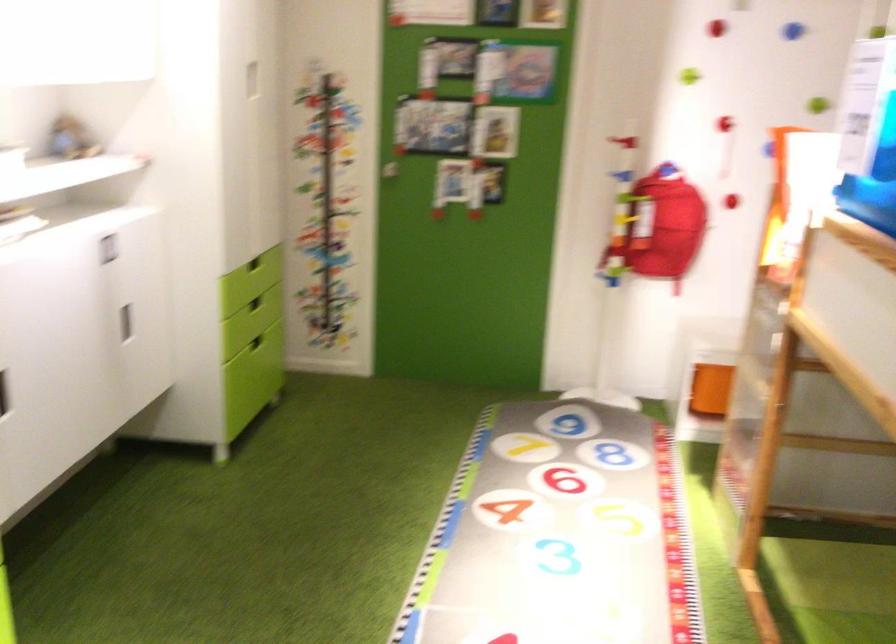
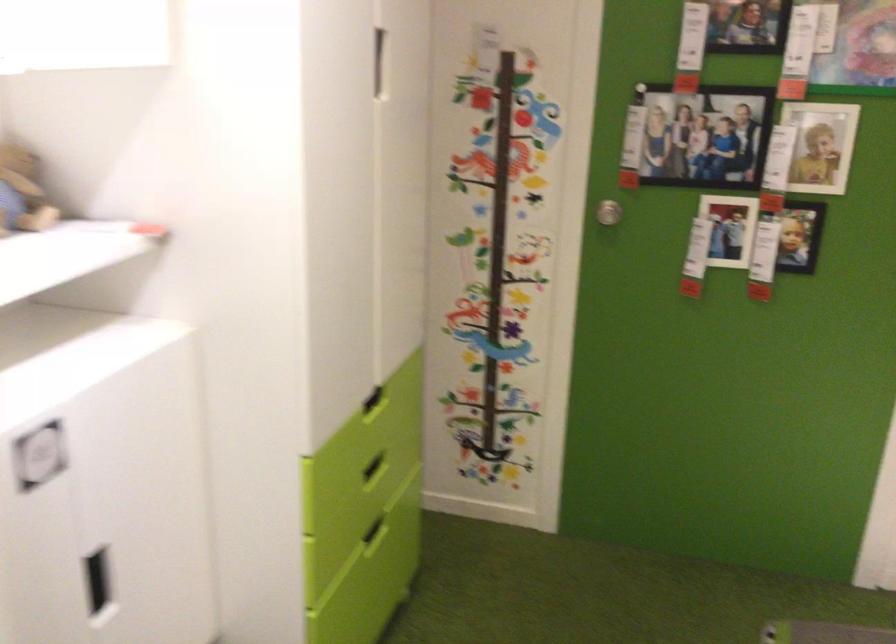
In the second image, find the point that corresponds to point (257, 337) in the first image.

(375, 531)